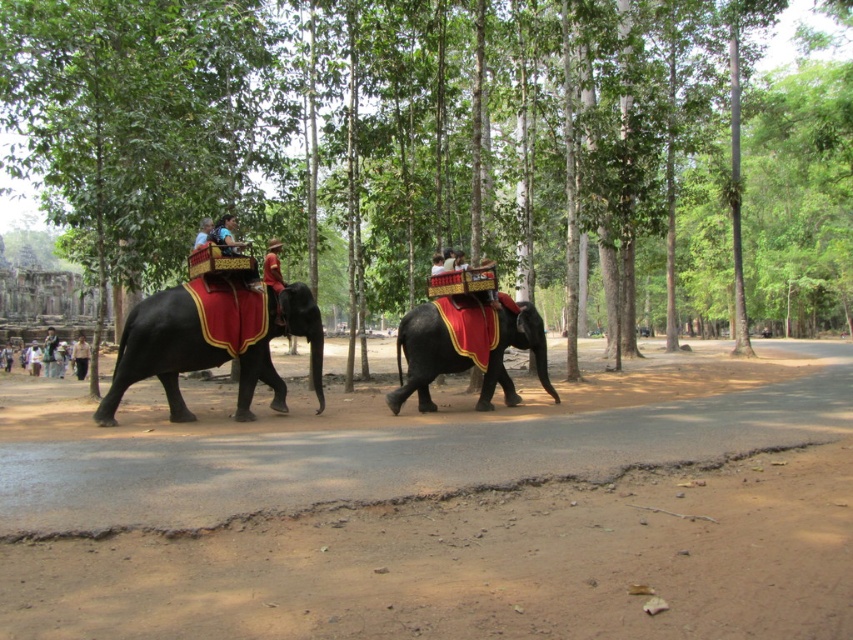
You are a photographer standing in the forest and want to capture a photo of the shiny black elephant at center and the light beige cotton shirt at center. Which object should you focus on first if you want to ensure both are in focus without adjusting the camera settings?

The shiny black elephant at center is smaller than the light beige cotton shirt at center, so focusing on the larger light beige cotton shirt at center first would help ensure both are in focus.

You are a photographer standing on the dirt path in the forest. You want to take a photo of the shiny black elephant at center and the light beige cotton shirt at center. Which object should you focus on first to ensure it appears sharp in your photo?

The shiny black elephant at center is closer to the viewer than the light beige cotton shirt at center, so you should focus on the shiny black elephant at center first to ensure it appears sharp.

You are a photographer trying to capture the best shot of the light beige cotton shirt at center. Where should you position your camera to ensure the shirt is in the frame?

The light beige cotton shirt at center is located at point coordinates 0.558 on the x axis and 0.095 on the y axis, so you should position your camera to aim towards those coordinates to ensure the shirt is in the frame.